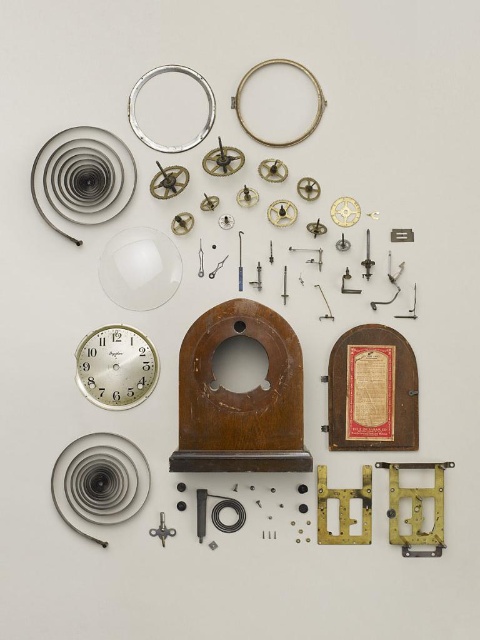
Question: Considering the relative positions of silver/metallic ring at upper left and silver/metallic ring at upper center in the image provided, where is silver/metallic ring at upper left located with respect to silver/metallic ring at upper center?

Choices:
 (A) below
 (B) above

Answer: (A)

Question: Among these objects, which one is nearest to the camera?

Choices:
 (A) metallic silver gear at center
 (B) transparent plastic plate at center
 (C) silver metallic clock face at center-left

Answer: (C)

Question: Is transparent plastic plate at center smaller than silver/metallic ring at upper center?

Choices:
 (A) yes
 (B) no

Answer: (A)

Question: Does silver/metallic ring at upper left have a smaller size compared to metallic silver gear at center?

Choices:
 (A) yes
 (B) no

Answer: (B)

Question: Which object is positioned farthest from the metallic silver gear at center?

Choices:
 (A) transparent plastic plate at center
 (B) silver metallic clock face at center-left
 (C) silver/metallic ring at upper center
 (D) silver/metallic ring at upper left

Answer: (C)

Question: Which object appears closest to the camera in this image?

Choices:
 (A) silver metallic clock face at center-left
 (B) silver/metallic ring at upper center
 (C) silver/metallic ring at upper left

Answer: (A)